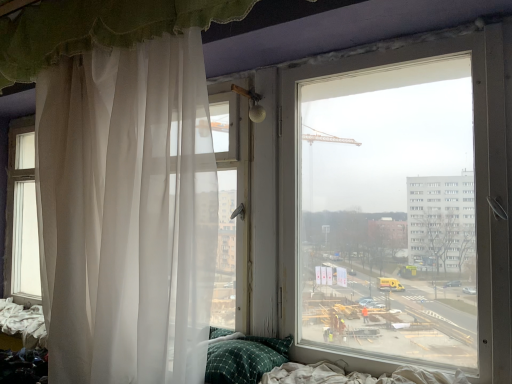
What do you see at coordinates (127, 213) in the screenshot? The height and width of the screenshot is (384, 512). I see `white sheer curtain at left, positioned as the 1th curtain in bottom-to-top order` at bounding box center [127, 213].

This screenshot has width=512, height=384. In order to click on green checkered pillow at lower center in this screenshot , I will do `click(245, 359)`.

Could you measure the distance between white sheer curtain at left, marked as the second curtain in a top-to-bottom arrangement, and white sheer curtain at upper left, the first curtain positioned from the top?

white sheer curtain at left, marked as the second curtain in a top-to-bottom arrangement, is 19.05 inches from white sheer curtain at upper left, the first curtain positioned from the top.

Is white sheer curtain at left, positioned as the 1th curtain in bottom-to-top order, oriented towards white sheer curtain at upper left, the first curtain positioned from the top?

No.

Looking at the image, does white sheer curtain at left, positioned as the 1th curtain in bottom-to-top order, seem bigger or smaller compared to white sheer curtain at upper left, the second curtain from the bottom?

Considering their sizes, white sheer curtain at left, positioned as the 1th curtain in bottom-to-top order, takes up more space than white sheer curtain at upper left, the second curtain from the bottom.

From the picture: Considering the relative positions of white sheer curtain at left, positioned as the 1th curtain in bottom-to-top order, and green checkered pillow at lower center in the image provided, is white sheer curtain at left, positioned as the 1th curtain in bottom-to-top order, in front of green checkered pillow at lower center?

Yes, the depth of white sheer curtain at left, positioned as the 1th curtain in bottom-to-top order, is less than that of green checkered pillow at lower center.

The height and width of the screenshot is (384, 512). Find the location of `the 2nd curtain counting from the left of the green checkered pillow at lower center`. the 2nd curtain counting from the left of the green checkered pillow at lower center is located at coordinates (127, 213).

Is green checkered pillow at lower center at the back of white sheer curtain at left, marked as the second curtain in a top-to-bottom arrangement?

Absolutely, white sheer curtain at left, marked as the second curtain in a top-to-bottom arrangement, is directed away from green checkered pillow at lower center.

Is white sheer curtain at upper left, the second curtain from the bottom, directly adjacent to white sheer curtain at left, positioned as the 1th curtain in bottom-to-top order?

No, white sheer curtain at upper left, the second curtain from the bottom, is not making contact with white sheer curtain at left, positioned as the 1th curtain in bottom-to-top order.

Based on the photo, looking at their sizes, would you say white sheer curtain at upper left, the second curtain from the bottom, is wider or thinner than white sheer curtain at left, marked as the second curtain in a top-to-bottom arrangement?

white sheer curtain at upper left, the second curtain from the bottom, is thinner than white sheer curtain at left, marked as the second curtain in a top-to-bottom arrangement.

Can we say white sheer curtain at upper left, the second curtain from the bottom, lies outside white sheer curtain at left, positioned as the 1th curtain in bottom-to-top order?

Yes, white sheer curtain at upper left, the second curtain from the bottom, is outside of white sheer curtain at left, positioned as the 1th curtain in bottom-to-top order.

Is white sheer curtain at upper left, the second curtain from the bottom, oriented away from white sheer curtain at left, positioned as the 1th curtain in bottom-to-top order?

No, white sheer curtain at upper left, the second curtain from the bottom,'s orientation is not away from white sheer curtain at left, positioned as the 1th curtain in bottom-to-top order.

The image size is (512, 384). I want to click on the 2nd curtain in front of the green checkered pillow at lower center, so click(98, 28).

Does green checkered pillow at lower center appear on the left side of white sheer curtain at upper left, the first curtain positioned from the top?

No.

Is green checkered pillow at lower center not inside white sheer curtain at upper left, the first curtain positioned from the top?

Yes, green checkered pillow at lower center is not within white sheer curtain at upper left, the first curtain positioned from the top.

From a real-world perspective, is green checkered pillow at lower center on top of white sheer curtain at upper left, the first curtain positioned from the top?

Incorrect, from a real-world perspective, green checkered pillow at lower center is lower than white sheer curtain at upper left, the first curtain positioned from the top.

Is white sheer curtain at upper left, the first curtain positioned from the top, wider than green checkered pillow at lower center?

No.

Considering the relative sizes of white sheer curtain at upper left, the second curtain from the bottom, and green checkered pillow at lower center in the image provided, is white sheer curtain at upper left, the second curtain from the bottom, smaller than green checkered pillow at lower center?

Actually, white sheer curtain at upper left, the second curtain from the bottom, might be larger than green checkered pillow at lower center.

From the image's perspective, is white sheer curtain at upper left, the second curtain from the bottom, located above green checkered pillow at lower center?

Yes, from the image's perspective, white sheer curtain at upper left, the second curtain from the bottom, is on top of green checkered pillow at lower center.

From a real-world perspective, is white sheer curtain at upper left, the second curtain from the bottom, located higher than green checkered pillow at lower center?

Yes, from a real-world perspective, white sheer curtain at upper left, the second curtain from the bottom, is above green checkered pillow at lower center.

From the image's perspective, between green checkered pillow at lower center and white sheer curtain at left, positioned as the 1th curtain in bottom-to-top order, which one is located above?

From the image's view, white sheer curtain at left, positioned as the 1th curtain in bottom-to-top order, is above.

Is green checkered pillow at lower center thinner than white sheer curtain at left, marked as the second curtain in a top-to-bottom arrangement?

Yes, green checkered pillow at lower center is thinner than white sheer curtain at left, marked as the second curtain in a top-to-bottom arrangement.

Where is `pillow that is behind the white sheer curtain at left, marked as the second curtain in a top-to-bottom arrangement`? The height and width of the screenshot is (384, 512). pillow that is behind the white sheer curtain at left, marked as the second curtain in a top-to-bottom arrangement is located at coordinates (245, 359).

Would you say green checkered pillow at lower center is a long distance from white sheer curtain at left, marked as the second curtain in a top-to-bottom arrangement?

No, green checkered pillow at lower center is in close proximity to white sheer curtain at left, marked as the second curtain in a top-to-bottom arrangement.

Locate an element on the screen. This screenshot has height=384, width=512. curtain above the white sheer curtain at left, marked as the second curtain in a top-to-bottom arrangement (from a real-world perspective) is located at coordinates (98, 28).

Locate an element on the screen. The width and height of the screenshot is (512, 384). curtain that is the 1st object located in front of the green checkered pillow at lower center is located at coordinates (127, 213).

Looking at the image, which one is located further to white sheer curtain at upper left, the first curtain positioned from the top, white sheer curtain at left, marked as the second curtain in a top-to-bottom arrangement, or green checkered pillow at lower center?

green checkered pillow at lower center is positioned further to the anchor white sheer curtain at upper left, the first curtain positioned from the top.

Estimate the real-world distances between objects in this image. Which object is further from white sheer curtain at left, marked as the second curtain in a top-to-bottom arrangement, green checkered pillow at lower center or white sheer curtain at upper left, the second curtain from the bottom?

Based on the image, green checkered pillow at lower center appears to be further to white sheer curtain at left, marked as the second curtain in a top-to-bottom arrangement.

In the scene shown: Based on their spatial positions, is white sheer curtain at upper left, the first curtain positioned from the top, or white sheer curtain at left, positioned as the 1th curtain in bottom-to-top order, closer to green checkered pillow at lower center?

white sheer curtain at left, positioned as the 1th curtain in bottom-to-top order, is closer to green checkered pillow at lower center.

From the image, which object appears to be farther from white sheer curtain at left, positioned as the 1th curtain in bottom-to-top order, white sheer curtain at upper left, the first curtain positioned from the top, or green checkered pillow at lower center?

The object further to white sheer curtain at left, positioned as the 1th curtain in bottom-to-top order, is green checkered pillow at lower center.

When comparing their distances from white sheer curtain at upper left, the first curtain positioned from the top, does green checkered pillow at lower center or white sheer curtain at left, positioned as the 1th curtain in bottom-to-top order, seem further?

green checkered pillow at lower center is further to white sheer curtain at upper left, the first curtain positioned from the top.

When comparing their distances from green checkered pillow at lower center, does white sheer curtain at left, marked as the second curtain in a top-to-bottom arrangement, or white sheer curtain at upper left, the second curtain from the bottom, seem further?

Among the two, white sheer curtain at upper left, the second curtain from the bottom, is located further to green checkered pillow at lower center.

Find the location of `curtain that lies between white sheer curtain at upper left, the first curtain positioned from the top, and green checkered pillow at lower center from top to bottom`. curtain that lies between white sheer curtain at upper left, the first curtain positioned from the top, and green checkered pillow at lower center from top to bottom is located at coordinates (127, 213).